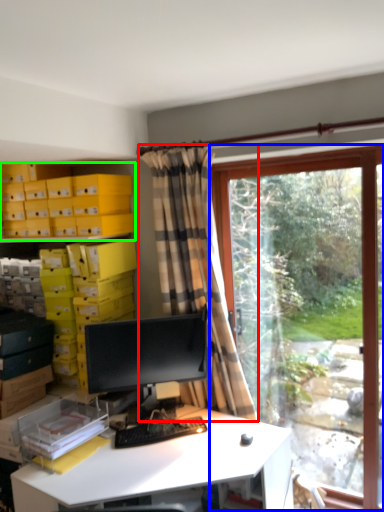
Question: Which is nearer to the curtain (highlighted by a red box)? window (highlighted by a blue box) or shelf (highlighted by a green box).

Choices:
 (A) window
 (B) shelf

Answer: (A)